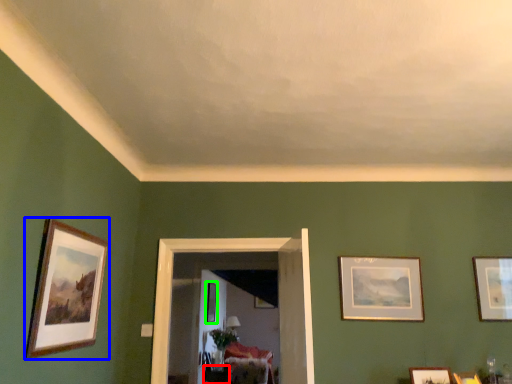
Question: Which object is the closest to the table (highlighted by a red box)? Choose among these: picture frame (highlighted by a blue box) or picture frame (highlighted by a green box).

Choices:
 (A) picture frame
 (B) picture frame

Answer: (B)